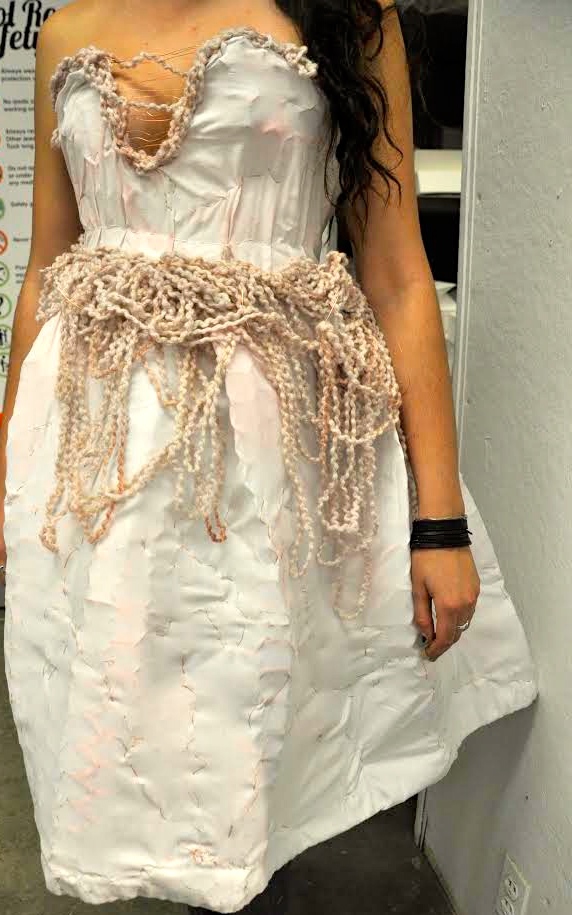
Locate an element on the screen. Image resolution: width=572 pixels, height=915 pixels. wall is located at coordinates (547, 562).